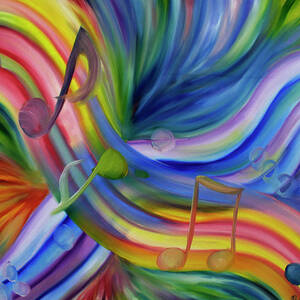
The image size is (300, 300). I want to click on art, so click(140, 101).